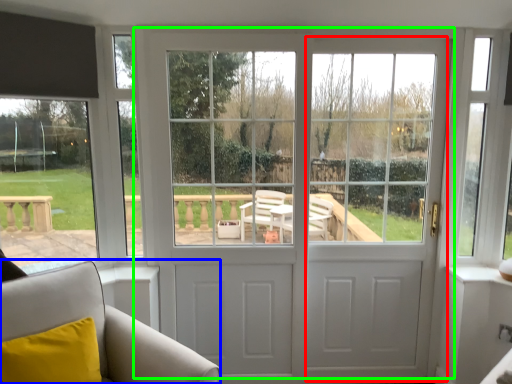
Question: Which is farther away from screen door (highlighted by a red box)? furniture (highlighted by a blue box) or door (highlighted by a green box)?

Choices:
 (A) furniture
 (B) door

Answer: (A)